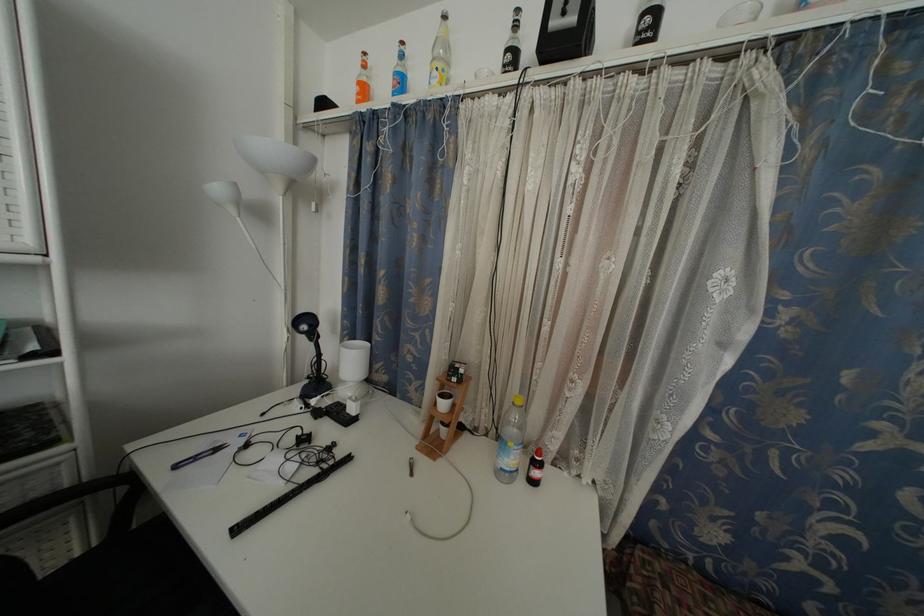
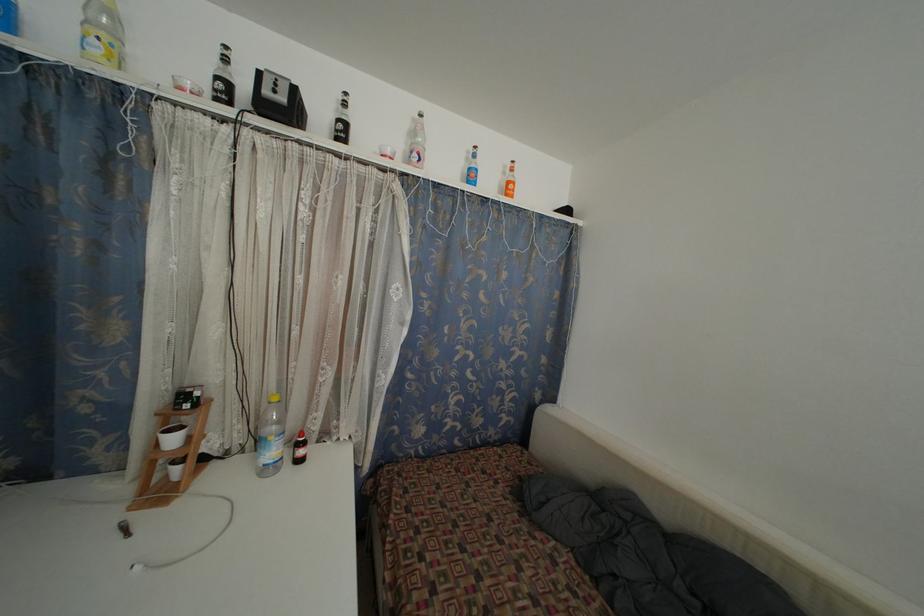
Locate, in the second image, the point that corresponds to point 514,63 in the first image.

(225, 91)